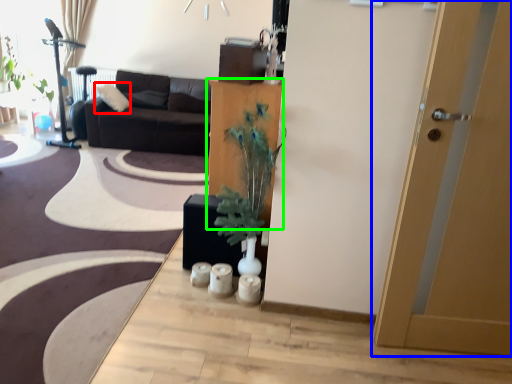
Question: Based on their relative distances, which object is farther from pillow (highlighted by a red box)? Choose from door (highlighted by a blue box) and cabinetry (highlighted by a green box).

Choices:
 (A) door
 (B) cabinetry

Answer: (A)